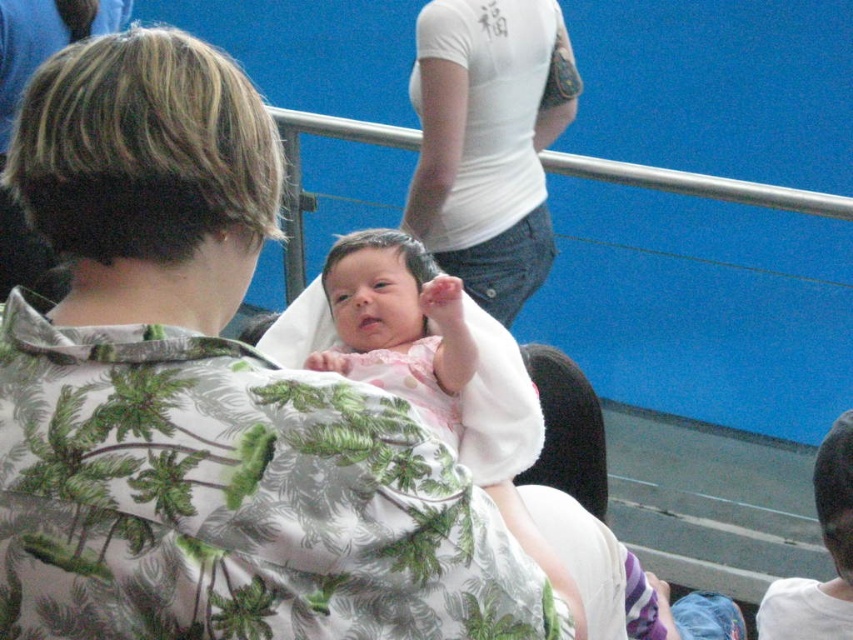
Is soft pink fabric baby at center above pink fabric newborn at center?

Actually, soft pink fabric baby at center is below pink fabric newborn at center.

Can you confirm if soft pink fabric baby at center is smaller than pink fabric newborn at center?

No.

Is point (422, 284) more distant than point (437, 275)?

That is True.

Find the location of `soft pink fabric baby at center`. soft pink fabric baby at center is located at coordinates (398, 324).

Between point (485, 147) and point (399, 340), which one is positioned in front?

Point (399, 340)

Identify the location of white matte t-shirt at upper center. (488, 141).

Locate an element on the screen. This screenshot has width=853, height=640. white matte t-shirt at upper center is located at coordinates (488, 141).

Who is lower down, white matte t-shirt at upper center or pink fabric newborn at center?

Positioned lower is pink fabric newborn at center.

Is point (422, 19) positioned after point (403, 332)?

Yes, point (422, 19) is behind point (403, 332).

Find the location of a particular element. This screenshot has height=640, width=853. white matte t-shirt at upper center is located at coordinates (488, 141).